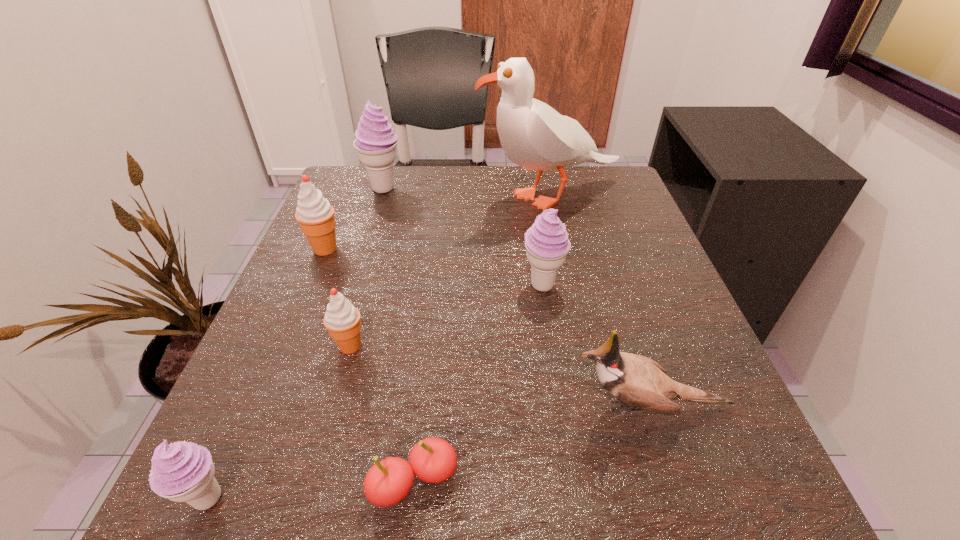
Find the location of a particular element. The height and width of the screenshot is (540, 960). gull that is at the right edge is located at coordinates (533, 135).

Identify the location of bird located at the right edge. This screenshot has width=960, height=540. (640, 382).

At what (x,y) coordinates should I click in order to perform the action: click on object situated at the far left corner. Please return your answer as a coordinate pair (x, y). The height and width of the screenshot is (540, 960). Looking at the image, I should click on (376, 142).

This screenshot has width=960, height=540. What are the coordinates of `object that is at the near left corner` in the screenshot? It's located at (182, 471).

Where is `object that is at the far right corner`? This screenshot has height=540, width=960. object that is at the far right corner is located at coordinates (533, 135).

Image resolution: width=960 pixels, height=540 pixels. Identify the location of vacant space at the far edge. coord(437,176).

Identify the location of vacant space at the near edge. The width and height of the screenshot is (960, 540). (503, 466).

What are the coordinates of `vacant region at the left edge` in the screenshot? It's located at (324, 417).

This screenshot has height=540, width=960. What are the coordinates of `free space at the right edge of the desktop` in the screenshot? It's located at (660, 289).

Where is `free region at the far left corner of the desktop`? This screenshot has width=960, height=540. free region at the far left corner of the desktop is located at coordinates (338, 214).